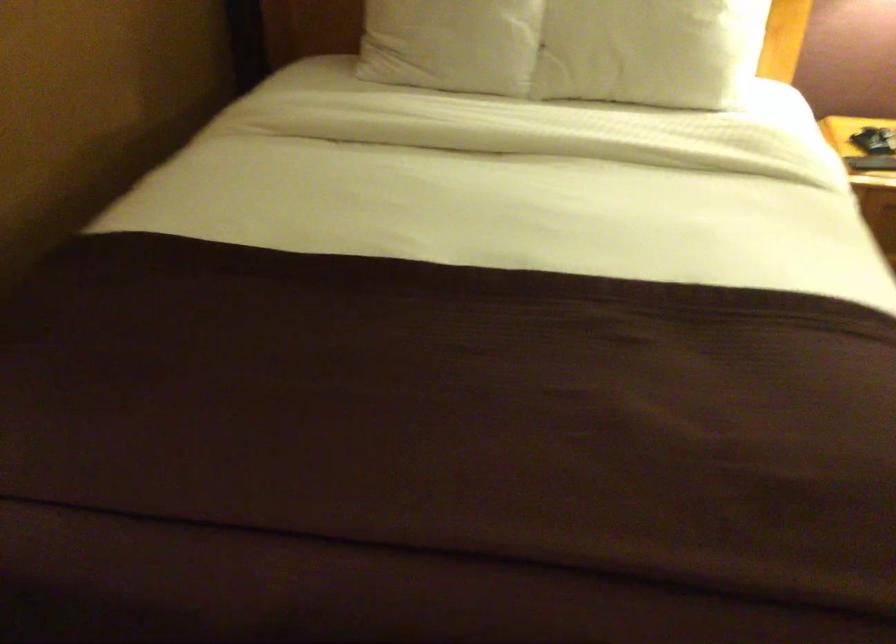
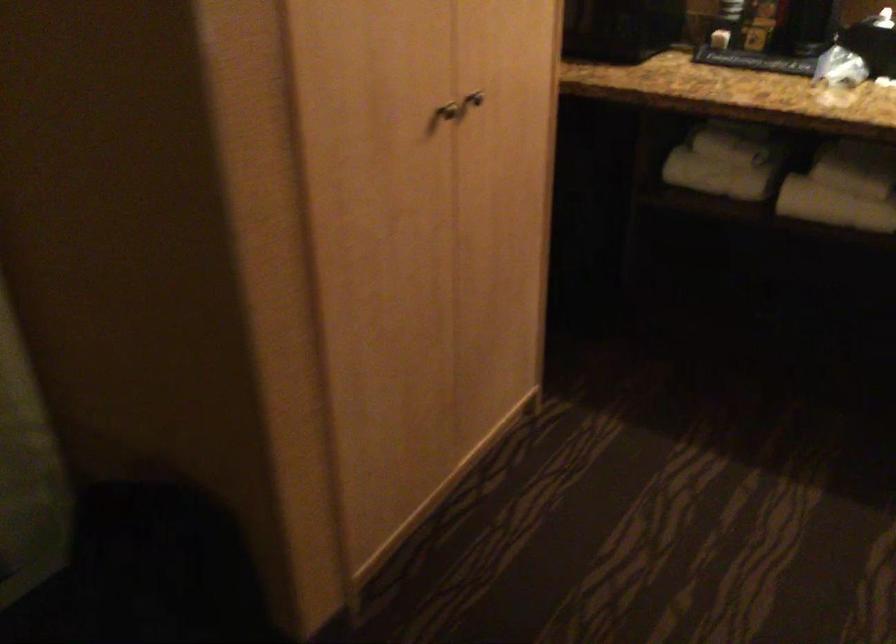
Looking at this image, the first image is from the beginning of the video and the second image is from the end. How did the camera likely rotate when shooting the video?

The camera's rotation is toward left-down.